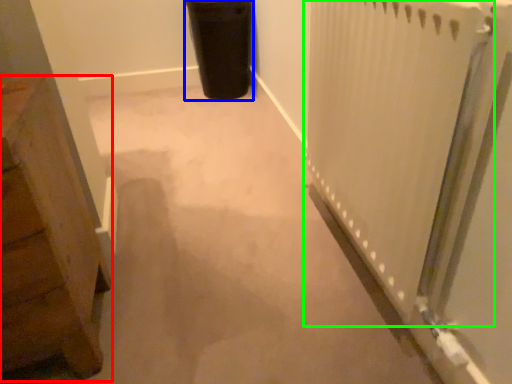
Question: Which object is the farthest from furniture (highlighted by a red box)? Choose among these: garbage (highlighted by a blue box) or radiator (highlighted by a green box).

Choices:
 (A) garbage
 (B) radiator

Answer: (A)